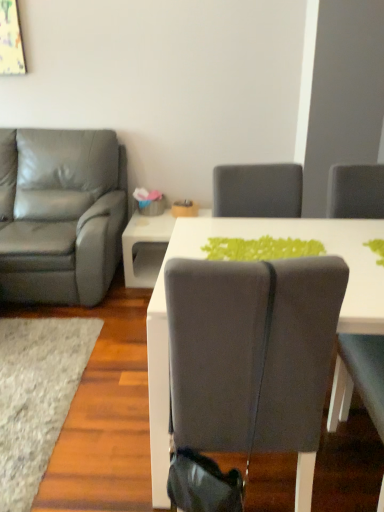
This screenshot has width=384, height=512. What do you see at coordinates (37, 396) in the screenshot? I see `soft gray carpet at lower left` at bounding box center [37, 396].

What do you see at coordinates (251, 352) in the screenshot? I see `matte gray chair at center, the 1th chair from the front` at bounding box center [251, 352].

Find the location of a particular element. The height and width of the screenshot is (512, 384). white glossy table at center is located at coordinates (145, 248).

What do you see at coordinates (145, 248) in the screenshot? I see `white glossy table at center` at bounding box center [145, 248].

Where is `matte gray leather armchair at left, positioned as the first chair in back-to-front order`? This screenshot has height=512, width=384. matte gray leather armchair at left, positioned as the first chair in back-to-front order is located at coordinates (63, 216).

Find the location of `chair that is the 1st object above the soft gray carpet at lower left (from a real-world perspective)`. chair that is the 1st object above the soft gray carpet at lower left (from a real-world perspective) is located at coordinates (251, 352).

Is soft gray carpet at lower left turned away from matte gray chair at center, marked as the 2th chair in a back-to-front arrangement?

No, matte gray chair at center, marked as the 2th chair in a back-to-front arrangement, is not at the back of soft gray carpet at lower left.

Which of these two, soft gray carpet at lower left or matte gray chair at center, the second chair viewed from the left, is thinner?

matte gray chair at center, the second chair viewed from the left.

Would you say white glossy table at center is a long distance from matte gray leather armchair at left, positioned as the first chair in back-to-front order?

No.

Find the location of a particular element. The image size is (384, 512). table on the right of the matte gray leather armchair at left, which ranks as the second chair in right-to-left order is located at coordinates (145, 248).

Considering the sizes of objects white glossy table at center and matte gray leather armchair at left, which ranks as the second chair in right-to-left order, in the image provided, who is wider, white glossy table at center or matte gray leather armchair at left, which ranks as the second chair in right-to-left order,?

matte gray leather armchair at left, which ranks as the second chair in right-to-left order.

Is white glossy table at center facing towards matte gray leather armchair at left, which ranks as the second chair in right-to-left order?

No, white glossy table at center is not oriented towards matte gray leather armchair at left, which ranks as the second chair in right-to-left order.

Considering the relative positions of matte gray leather armchair at left, positioned as the first chair in back-to-front order, and matte gray chair at center, the first chair from the right, in the image provided, is matte gray leather armchair at left, positioned as the first chair in back-to-front order, to the right of matte gray chair at center, the first chair from the right, from the viewer's perspective?

Incorrect, matte gray leather armchair at left, positioned as the first chair in back-to-front order, is not on the right side of matte gray chair at center, the first chair from the right.

Which object is closer to the camera, matte gray leather armchair at left, positioned as the first chair in back-to-front order, or matte gray chair at center, the first chair from the right?

matte gray chair at center, the first chair from the right, is more forward.

From a real-world perspective, which object rests below the other?

From a 3D spatial view, matte gray chair at center, the 1th chair from the front, is below.

In the scene shown: Is matte gray chair at center, marked as the 2th chair in a back-to-front arrangement, oriented towards matte gray leather armchair at left, positioned as the first chair in back-to-front order?

No, matte gray chair at center, marked as the 2th chair in a back-to-front arrangement, does not turn towards matte gray leather armchair at left, positioned as the first chair in back-to-front order.

Which is closer to the camera, (x=182, y=306) or (x=31, y=221)?

Positioned in front is point (x=182, y=306).

Based on the photo, which is more to the left, matte gray chair at center, marked as the 2th chair in a back-to-front arrangement, or soft gray carpet at lower left?

soft gray carpet at lower left is more to the left.

From the image's perspective, which one is positioned higher, matte gray chair at center, the second chair viewed from the left, or soft gray carpet at lower left?

matte gray chair at center, the second chair viewed from the left.

Is matte gray chair at center, the 1th chair from the front, wider or thinner than soft gray carpet at lower left?

matte gray chair at center, the 1th chair from the front, is thinner than soft gray carpet at lower left.

Find the location of a particular element. This screenshot has height=512, width=384. mat below the matte gray chair at center, marked as the 2th chair in a back-to-front arrangement (from the image's perspective) is located at coordinates (37, 396).

Is white glossy table at center in contact with soft gray carpet at lower left?

No, white glossy table at center is not with soft gray carpet at lower left.

From the image's perspective, is white glossy table at center on top of soft gray carpet at lower left?

Yes, from the image's perspective, white glossy table at center is over soft gray carpet at lower left.

Which is behind, point (165, 227) or point (23, 496)?

The point (165, 227) is more distant.

Where is `table lying behind the soft gray carpet at lower left`? This screenshot has height=512, width=384. table lying behind the soft gray carpet at lower left is located at coordinates (145, 248).

From the picture: How different are the orientations of soft gray carpet at lower left and matte gray leather armchair at left, marked as the 1th chair in a left-to-right arrangement, in degrees?

1.07 degrees separate the facing orientations of soft gray carpet at lower left and matte gray leather armchair at left, marked as the 1th chair in a left-to-right arrangement.

Is soft gray carpet at lower left taller than matte gray leather armchair at left, acting as the 2th chair starting from the front?

In fact, soft gray carpet at lower left may be shorter than matte gray leather armchair at left, acting as the 2th chair starting from the front.

In terms of width, does soft gray carpet at lower left look wider or thinner when compared to matte gray leather armchair at left, which ranks as the second chair in right-to-left order?

soft gray carpet at lower left is wider than matte gray leather armchair at left, which ranks as the second chair in right-to-left order.

Is matte gray leather armchair at left, positioned as the first chair in back-to-front order, located within soft gray carpet at lower left?

No, matte gray leather armchair at left, positioned as the first chair in back-to-front order, is not inside soft gray carpet at lower left.

The height and width of the screenshot is (512, 384). Find the location of `chair on the right side of soft gray carpet at lower left`. chair on the right side of soft gray carpet at lower left is located at coordinates (251, 352).

From a real-world perspective, which chair is the 2nd one above the white glossy table at center? Please provide its 2D coordinates.

[(63, 216)]

From the image, which object appears to be farther from matte gray chair at center, marked as the 2th chair in a back-to-front arrangement, matte gray leather armchair at left, positioned as the first chair in back-to-front order, or white glossy table at center?

Among the two, white glossy table at center is located further to matte gray chair at center, marked as the 2th chair in a back-to-front arrangement.

Considering their positions, is soft gray carpet at lower left positioned closer to matte gray chair at center, marked as the 2th chair in a back-to-front arrangement, than matte gray leather armchair at left, which ranks as the second chair in right-to-left order?

soft gray carpet at lower left is positioned closer to the anchor matte gray chair at center, marked as the 2th chair in a back-to-front arrangement.

Based on their spatial positions, is white glossy table at center or soft gray carpet at lower left closer to matte gray leather armchair at left, which ranks as the second chair in right-to-left order?

Based on the image, white glossy table at center appears to be nearer to matte gray leather armchair at left, which ranks as the second chair in right-to-left order.

Based on their spatial positions, is matte gray leather armchair at left, marked as the 1th chair in a left-to-right arrangement, or matte gray chair at center, the first chair from the right, further from white glossy table at center?

matte gray chair at center, the first chair from the right.

When comparing their distances from matte gray chair at center, the 1th chair from the front, does matte gray leather armchair at left, marked as the 1th chair in a left-to-right arrangement, or soft gray carpet at lower left seem closer?

soft gray carpet at lower left is positioned closer to the anchor matte gray chair at center, the 1th chair from the front.

Considering their positions, is soft gray carpet at lower left positioned closer to matte gray leather armchair at left, marked as the 1th chair in a left-to-right arrangement, than matte gray chair at center, marked as the 2th chair in a back-to-front arrangement?

soft gray carpet at lower left lies closer to matte gray leather armchair at left, marked as the 1th chair in a left-to-right arrangement, than the other object.

Estimate the real-world distances between objects in this image. Which object is closer to matte gray chair at center, the first chair from the right, white glossy table at center or soft gray carpet at lower left?

soft gray carpet at lower left lies closer to matte gray chair at center, the first chair from the right, than the other object.

From the image, which object appears to be farther from matte gray chair at center, the first chair from the right, white glossy table at center or matte gray leather armchair at left, positioned as the first chair in back-to-front order?

white glossy table at center.

Identify the location of chair between matte gray chair at center, marked as the 2th chair in a back-to-front arrangement, and white glossy table at center from front to back. (63, 216).

In order to click on chair between soft gray carpet at lower left and white glossy table at center in the front-back direction in this screenshot , I will do `click(63, 216)`.

At what (x,y) coordinates should I click in order to perform the action: click on mat between matte gray chair at center, the 1th chair from the front, and white glossy table at center, along the z-axis. Please return your answer as a coordinate pair (x, y). This screenshot has width=384, height=512. Looking at the image, I should click on point(37,396).

Image resolution: width=384 pixels, height=512 pixels. Identify the location of mat between matte gray chair at center, marked as the 2th chair in a back-to-front arrangement, and matte gray leather armchair at left, acting as the 2th chair starting from the front, in the front-back direction. (37, 396).